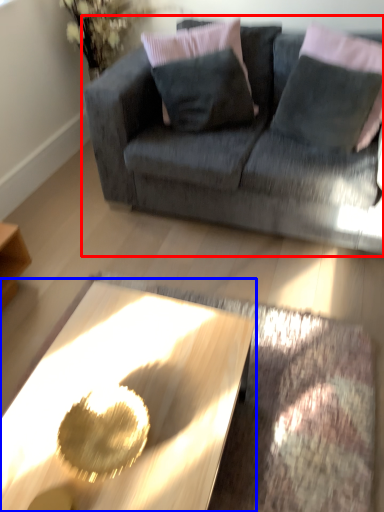
Question: Which of the following is the farthest to the observer, studio couch (highlighted by a red box) or coffee table (highlighted by a blue box)?

Choices:
 (A) studio couch
 (B) coffee table

Answer: (A)